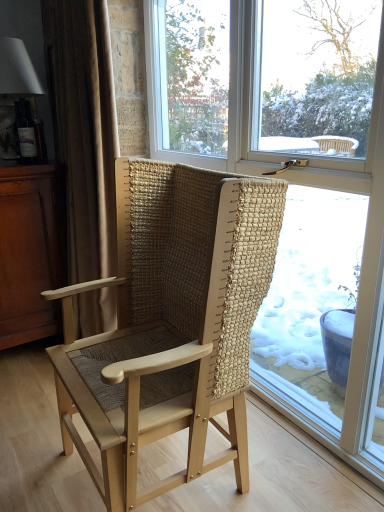
Describe the element at coordinates (31, 251) in the screenshot. The width and height of the screenshot is (384, 512). I see `dark brown wood dresser at left` at that location.

You are a GUI agent. You are given a task and a screenshot of the screen. Output one action in this format:
    pyautogui.click(x=<x>, y=<y>)
    Task: Click on the matte white lampshade at upper left
    Image resolution: width=384 pixels, height=512 pixels.
    Given the screenshot: What is the action you would take?
    pyautogui.click(x=19, y=104)

Find the location of a particular element. Image resolution: width=384 pixels, height=512 pixels. natural woven wood chair at center is located at coordinates (171, 323).

Is beige fabric curtain at left not inside transparent glass window at center?

Absolutely, beige fabric curtain at left is external to transparent glass window at center.

Would you consider beige fabric curtain at left to be distant from transparent glass window at center?

beige fabric curtain at left is actually quite close to transparent glass window at center.

From the image's perspective, is beige fabric curtain at left above or below transparent glass window at center?

beige fabric curtain at left is situated higher than transparent glass window at center in the image.

Considering the positions of objects transparent glass window at center and matte white lampshade at upper left in the image provided, who is more to the right, transparent glass window at center or matte white lampshade at upper left?

transparent glass window at center.

Can you confirm if transparent glass window at center is wider than matte white lampshade at upper left?

No, transparent glass window at center is not wider than matte white lampshade at upper left.

Is the depth of transparent glass window at center greater than that of matte white lampshade at upper left?

That is False.

Is transparent glass window at center not close to matte white lampshade at upper left?

That's right, there is a large distance between transparent glass window at center and matte white lampshade at upper left.

From the image's perspective, would you say natural woven wood chair at center is positioned over dark brown wood dresser at left?

No, from the image's perspective, natural woven wood chair at center is not above dark brown wood dresser at left.

Is natural woven wood chair at center bigger or smaller than dark brown wood dresser at left?

Considering their sizes, natural woven wood chair at center takes up more space than dark brown wood dresser at left.

This screenshot has width=384, height=512. I want to click on dresser below the natural woven wood chair at center (from a real-world perspective), so click(31, 251).

Considering the points (206, 173) and (10, 300), which point is behind, point (206, 173) or point (10, 300)?

The point (10, 300) is more distant.

From the image's perspective, does natural woven wood chair at center appear higher than transparent glass window at center?

No, from the image's perspective, natural woven wood chair at center is not above transparent glass window at center.

Is point (142, 317) closer to camera compared to point (229, 16)?

That is False.

Between natural woven wood chair at center and transparent glass window at center, which one has smaller width?

With smaller width is transparent glass window at center.

Is transparent glass window at center at the back of natural woven wood chair at center?

Yes, transparent glass window at center is at the back of natural woven wood chair at center.

In the scene shown: Which object is closer to the camera, transparent glass window at center or natural woven wood chair at center?

natural woven wood chair at center is in front.

Is transparent glass window at center located outside natural woven wood chair at center?

Yes, transparent glass window at center is located beyond the bounds of natural woven wood chair at center.

From a real-world perspective, who is located lower, transparent glass window at center or natural woven wood chair at center?

natural woven wood chair at center, from a real-world perspective.

Considering the sizes of transparent glass window at center and natural woven wood chair at center in the image, is transparent glass window at center bigger or smaller than natural woven wood chair at center?

Clearly, transparent glass window at center is smaller in size than natural woven wood chair at center.

Which point is more distant from viewer, (363, 103) or (45, 202)?

The point (45, 202) is farther.

How different are the orientations of transparent glass window at center and dark brown wood dresser at left in degrees?

There is a 88.6-degree angle between the facing directions of transparent glass window at center and dark brown wood dresser at left.

Would you say transparent glass window at center is a long distance from dark brown wood dresser at left?

Yes.

Choose the correct answer: Is transparent glass window at center inside beige fabric curtain at left or outside it?

transparent glass window at center is located beyond the bounds of beige fabric curtain at left.

Considering the points (156, 29) and (104, 36), which point is in front, point (156, 29) or point (104, 36)?

The point (104, 36) is closer.

Considering the sizes of transparent glass window at center and beige fabric curtain at left in the image, is transparent glass window at center taller or shorter than beige fabric curtain at left?

Clearly, transparent glass window at center is taller compared to beige fabric curtain at left.

You are a GUI agent. You are given a task and a screenshot of the screen. Output one action in this format:
    pyautogui.click(x=<x>, y=<y>)
    Task: Click on the window that appears above the beige fabric curtain at left (from a real-world perspective)
    The image size is (384, 512).
    Given the screenshot: What is the action you would take?
    pyautogui.click(x=293, y=186)

Where is `window that appears on the right of matte white lampshade at upper left`? The image size is (384, 512). window that appears on the right of matte white lampshade at upper left is located at coordinates (293, 186).

Looking at the image, which one is located further to beige fabric curtain at left, natural woven wood chair at center or matte white lampshade at upper left?

Based on the image, natural woven wood chair at center appears to be further to beige fabric curtain at left.

From the image, which object appears to be nearer to beige fabric curtain at left, dark brown wood dresser at left or matte white lampshade at upper left?

dark brown wood dresser at left is closer to beige fabric curtain at left.

Based on their spatial positions, is dark brown wood dresser at left or matte white lampshade at upper left closer to natural woven wood chair at center?

dark brown wood dresser at left.

Considering their positions, is transparent glass window at center positioned closer to natural woven wood chair at center than beige fabric curtain at left?

beige fabric curtain at left is closer to natural woven wood chair at center.

When comparing their distances from natural woven wood chair at center, does beige fabric curtain at left or matte white lampshade at upper left seem further?

matte white lampshade at upper left is positioned further to the anchor natural woven wood chair at center.

Based on their spatial positions, is matte white lampshade at upper left or dark brown wood dresser at left closer to natural woven wood chair at center?

The object closer to natural woven wood chair at center is dark brown wood dresser at left.

When comparing their distances from matte white lampshade at upper left, does transparent glass window at center or beige fabric curtain at left seem closer?

Based on the image, beige fabric curtain at left appears to be nearer to matte white lampshade at upper left.

Looking at the image, which one is located further to beige fabric curtain at left, natural woven wood chair at center or transparent glass window at center?

Among the two, transparent glass window at center is located further to beige fabric curtain at left.

Image resolution: width=384 pixels, height=512 pixels. What are the coordinates of `curtain between dark brown wood dresser at left and transparent glass window at center in the horizontal direction` in the screenshot? It's located at (84, 130).

I want to click on curtain between matte white lampshade at upper left and transparent glass window at center from left to right, so click(84, 130).

You are a GUI agent. You are given a task and a screenshot of the screen. Output one action in this format:
    pyautogui.click(x=<x>, y=<y>)
    Task: Click on the curtain between natural woven wood chair at center and matte white lampshade at upper left along the z-axis
    
    Given the screenshot: What is the action you would take?
    pyautogui.click(x=84, y=130)

The image size is (384, 512). I want to click on curtain between natural woven wood chair at center and dark brown wood dresser at left from front to back, so click(84, 130).